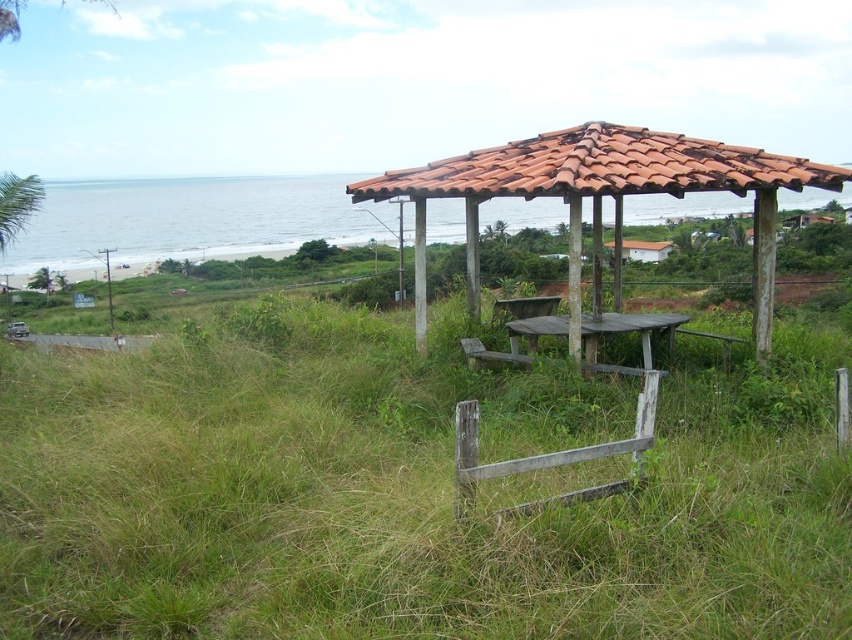
Is wooden park bench at center thinner than white matte house at center?

Correct, wooden park bench at center's width is less than white matte house at center's.

Is point (551, 317) positioned behind point (636, 253)?

No, it is in front of (636, 253).

The width and height of the screenshot is (852, 640). Identify the location of wooden park bench at center. (496, 352).

Does blue water at upper center have a smaller size compared to wooden park bench at center?

Actually, blue water at upper center might be larger than wooden park bench at center.

Who is shorter, blue water at upper center or wooden park bench at center?

wooden park bench at center is shorter.

At what (x,y) coordinates should I click in order to perform the action: click on blue water at upper center. Please return your answer as a coordinate pair (x, y). Looking at the image, I should click on [x=188, y=221].

Does green grassy at center have a greater width compared to white matte house at center?

No, green grassy at center is not wider than white matte house at center.

Is point (384, 413) positioned in front of point (658, 257)?

Yes.

Find the location of `green grassy at center`. green grassy at center is located at coordinates (401, 497).